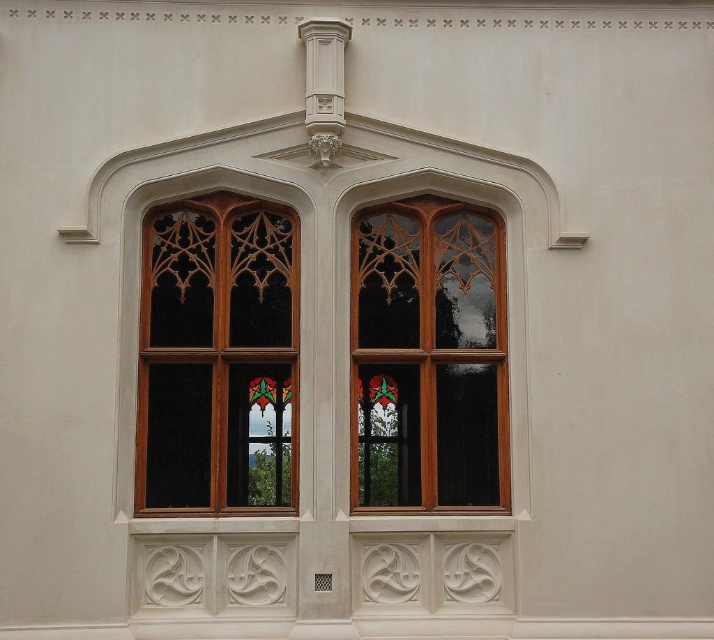
Does clear stained glass at left have a lesser width compared to stained glass window at center?

Incorrect, clear stained glass at left's width is not less than stained glass window at center's.

Looking at this image, between clear stained glass at left and stained glass window at center, which one is positioned lower?

stained glass window at center is below.

Between point (196, 273) and point (486, 360), which one is positioned in front?

Point (486, 360) is more forward.

This screenshot has width=714, height=640. In order to click on clear stained glass at left in this screenshot , I will do `click(218, 356)`.